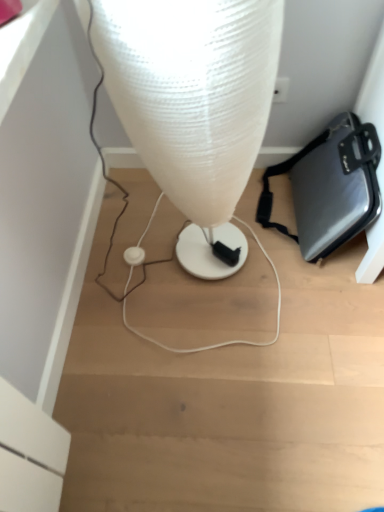
Locate an element on the screen. unoccupied area behind white plastic earphone at center is located at coordinates (127, 222).